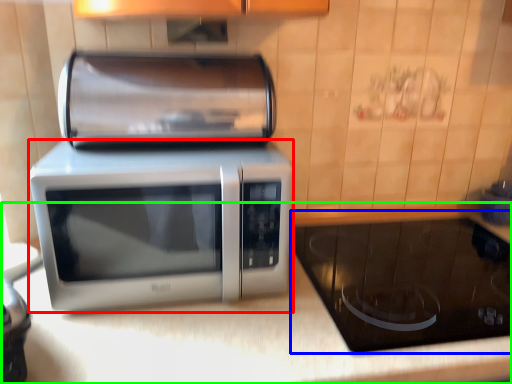
Question: Which object is positioned farthest from microwave oven (highlighted by a red box)? Select from appliance (highlighted by a blue box) and counter top (highlighted by a green box).

Choices:
 (A) appliance
 (B) counter top

Answer: (A)